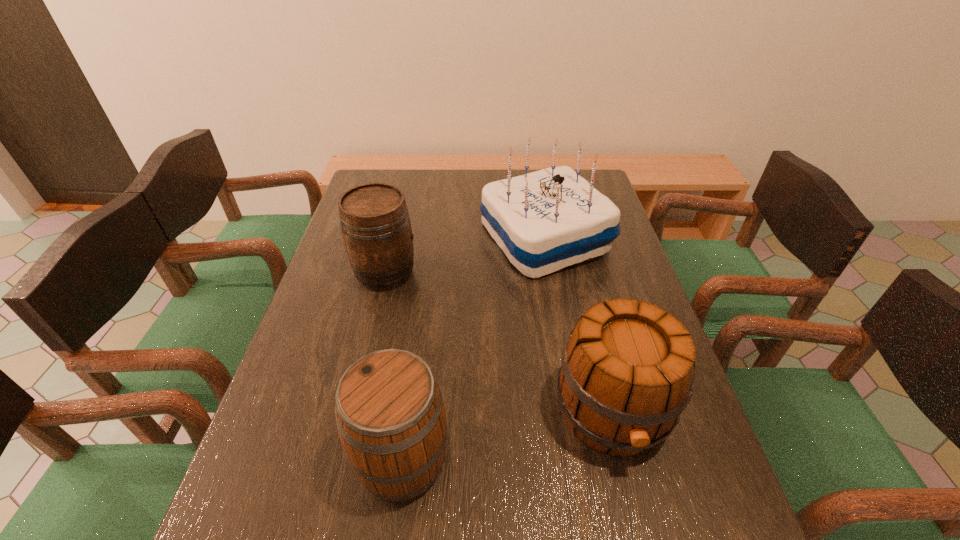
What are the coordinates of `object that is at the far right corner` in the screenshot? It's located at tap(544, 221).

The height and width of the screenshot is (540, 960). Find the location of `free space at the far edge of the desktop`. free space at the far edge of the desktop is located at coordinates (407, 184).

Where is `vacant space at the left edge of the desktop`? The height and width of the screenshot is (540, 960). vacant space at the left edge of the desktop is located at coordinates (360, 352).

In the image, there is a desktop. What are the coordinates of `vacant space at the right edge` in the screenshot? It's located at (705, 456).

This screenshot has height=540, width=960. What are the coordinates of `vacant region at the far left corner of the desktop` in the screenshot? It's located at (402, 172).

Image resolution: width=960 pixels, height=540 pixels. I want to click on empty location between the birthday cake and the farthest cider, so click(465, 255).

Where is `empty space that is in between the farthest cider and the birthday cake`? The width and height of the screenshot is (960, 540). empty space that is in between the farthest cider and the birthday cake is located at coordinates (465, 255).

Where is `free point between the farthest cider and the birthday cake`? free point between the farthest cider and the birthday cake is located at coordinates (x=465, y=255).

Identify which object is located as the second nearest to the rightmost cider. Please provide its 2D coordinates. Your answer should be formatted as a tuple, i.e. [(x, y)], where the tuple contains the x and y coordinates of a point satisfying the conditions above.

[(544, 221)]

Point out which object is positioned as the third nearest to the birthday cake. Please provide its 2D coordinates. Your answer should be formatted as a tuple, i.e. [(x, y)], where the tuple contains the x and y coordinates of a point satisfying the conditions above.

[(390, 414)]